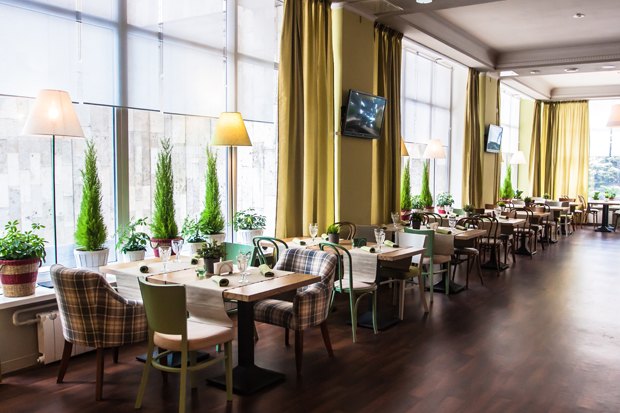
At what (x,y) coordinates should I click in order to perform the action: click on lights. Please return your answer as a coordinate pair (x, y). Image resolution: width=620 pixels, height=413 pixels. Looking at the image, I should click on (64, 115), (232, 121), (405, 152), (432, 148), (614, 121).